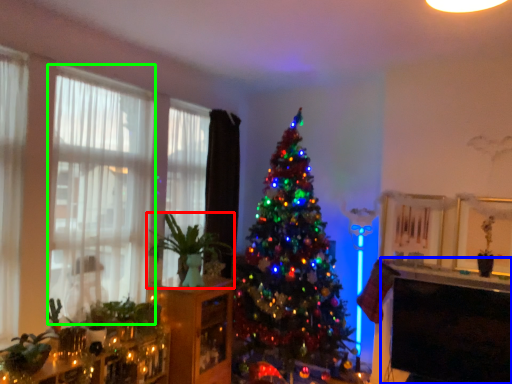
Question: Estimate the real-world distances between objects in this image. Which object is closer to houseplant (highlighted by a red box), table (highlighted by a blue box) or window (highlighted by a green box)?

Choices:
 (A) table
 (B) window

Answer: (B)